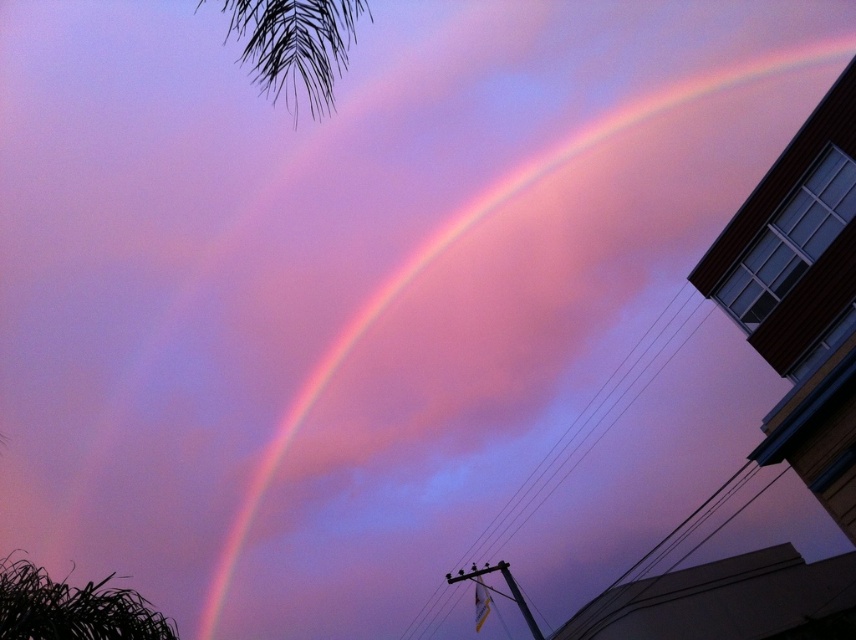
You are an artist trying to paint the sunset scene. You need to decide the size of the rainbow at upper center and black leafy palm at upper left. Which object should you paint larger?

The rainbow at upper center should be painted larger than the black leafy palm at upper left because the rainbow at upper center has a larger size compared to black leafy palm at upper left.

You are an architect designing a new observatory. You want to ensure the main telescope can view the rainbow at upper center without obstruction from the black leafy palm at upper left. Given the distance between them is 20.75 meters, what is the minimum vertical clearance needed between the telescope and the palm tree branch to maintain an unobstructed view?

The rainbow at upper center is 20.75 meters from the black leafy palm at upper left. To ensure the telescope has an unobstructed view, the vertical clearance between the telescope and the palm tree branch should be at least 20.75 meters.

You are an artist trying to sketch the sunset scene. You notice the rainbow at upper center and the black leafy palm at upper left. Which object in the scene is wider?

The rainbow at upper center is wider than the black leafy palm at upper left according to the description.